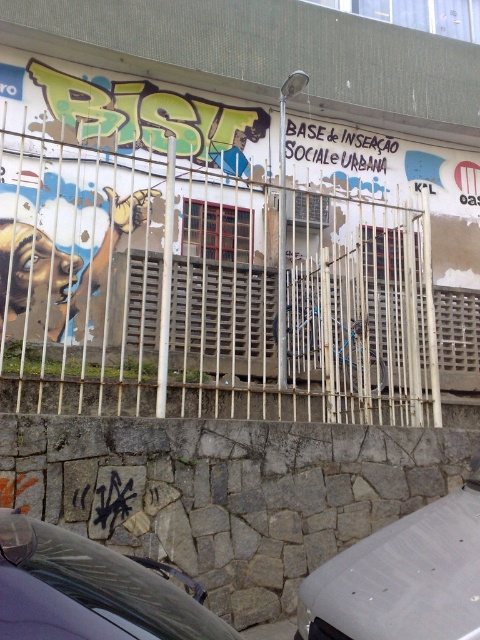
In the scene shown: Can you confirm if rusty metal fence at center is positioned above white matte car at lower right?

Indeed, rusty metal fence at center is positioned over white matte car at lower right.

Is rusty metal fence at center positioned behind white matte car at lower right?

Yes, rusty metal fence at center is behind white matte car at lower right.

You are a GUI agent. You are given a task and a screenshot of the screen. Output one action in this format:
    pyautogui.click(x=<x>, y=<y>)
    Task: Click on the rusty metal fence at center
    The image size is (480, 640).
    Given the screenshot: What is the action you would take?
    pyautogui.click(x=207, y=291)

Can you confirm if white matte car at lower right is positioned to the right of shiny black car at lower left?

Correct, you'll find white matte car at lower right to the right of shiny black car at lower left.

Which is in front, point (354, 573) or point (172, 589)?

Point (172, 589)

This screenshot has width=480, height=640. Find the location of `white matte car at lower right`. white matte car at lower right is located at coordinates (402, 579).

Which is in front, point (312, 364) or point (132, 632)?

Positioned in front is point (132, 632).

Can you confirm if rusty metal fence at center is smaller than shiny black car at lower left?

Incorrect, rusty metal fence at center is not smaller in size than shiny black car at lower left.

You are a GUI agent. You are given a task and a screenshot of the screen. Output one action in this format:
    pyautogui.click(x=<x>, y=<y>)
    Task: Click on the rusty metal fence at center
    Image resolution: width=480 pixels, height=640 pixels.
    Given the screenshot: What is the action you would take?
    pyautogui.click(x=207, y=291)